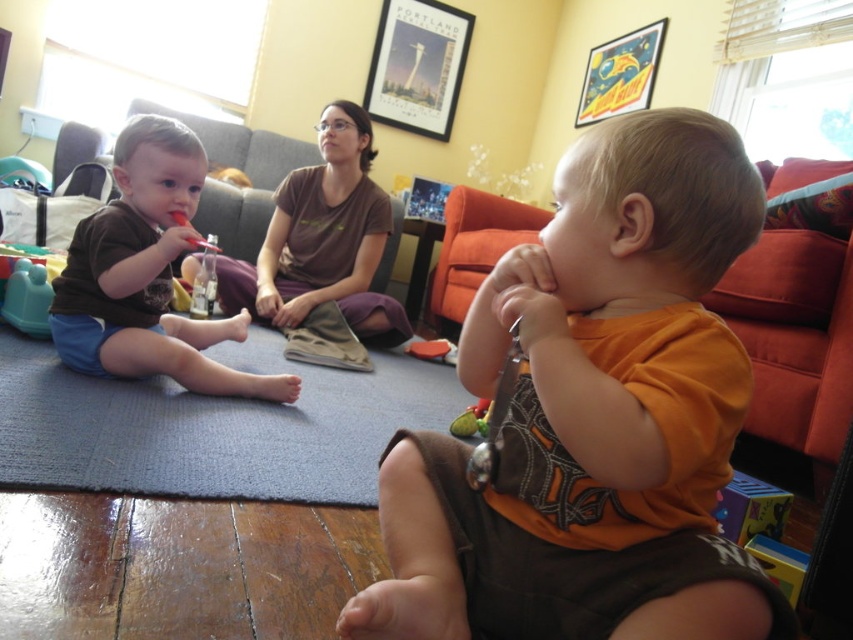
Question: Which of the following is the closest to the observer?

Choices:
 (A) (354, 202)
 (B) (635, 81)
 (C) (137, 192)

Answer: (C)

Question: Does brown cotton shirt at center have a smaller size compared to metallic gold poster at upper right?

Choices:
 (A) yes
 (B) no

Answer: (B)

Question: Can you confirm if orange cotton shirt at center is positioned above metallic gold poster at upper right?

Choices:
 (A) yes
 (B) no

Answer: (B)

Question: Among these objects, which one is nearest to the camera?

Choices:
 (A) matte brown shorts at left
 (B) metallic poster at upper center
 (C) blue carpet at lower left

Answer: (C)

Question: From the image, what is the correct spatial relationship of blue carpet at lower left in relation to matte plastic toy at left?

Choices:
 (A) right
 (B) left

Answer: (A)

Question: Which object appears closest to the camera in this image?

Choices:
 (A) metallic gold poster at upper right
 (B) matte plastic toy at left
 (C) orange cotton shirt at center
 (D) brown cotton shirt at center

Answer: (C)